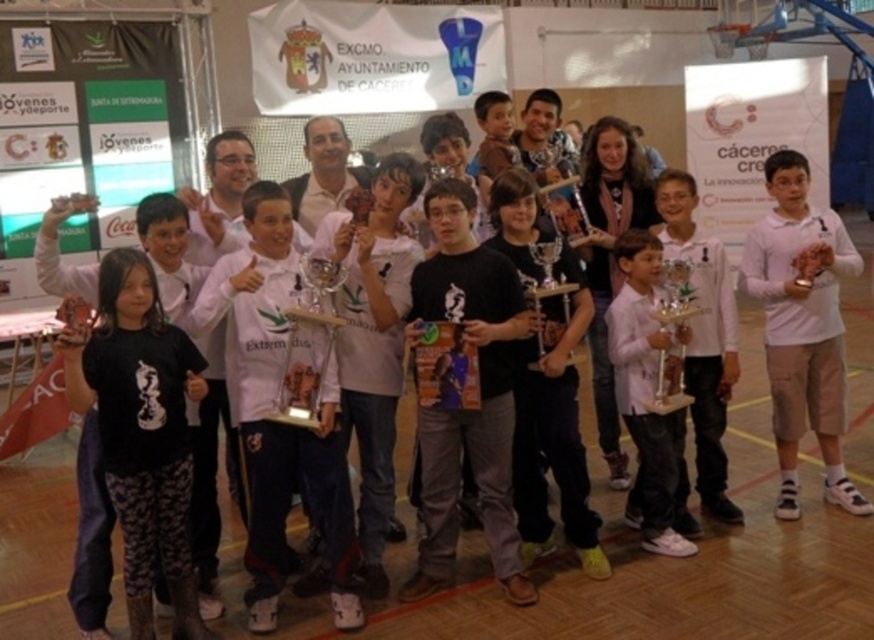
You are standing in the gymnasium and want to place a small decoration between the two points, point [94,387] and point [840,484]. Which point is closer to you where you should start placing the decoration?

Point [94,387] is closer to the viewer than point [840,484], so you should start placing the decoration near point [94,387].

You are organizing a photo shoot and need to ensure that all items in the image are visible. The white cotton shirt at right and the metallic silver trophy at center are both important elements. Given their sizes, which item might require more space in the frame to ensure it is fully captured?

The white cotton shirt at right is bigger than the metallic silver trophy at center, so it would require more space in the frame to ensure it is fully captured.